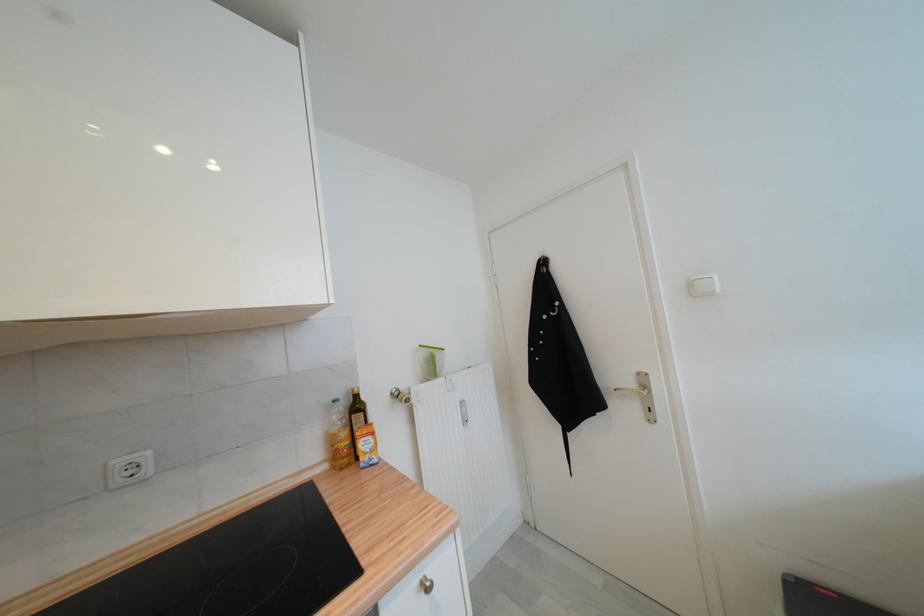
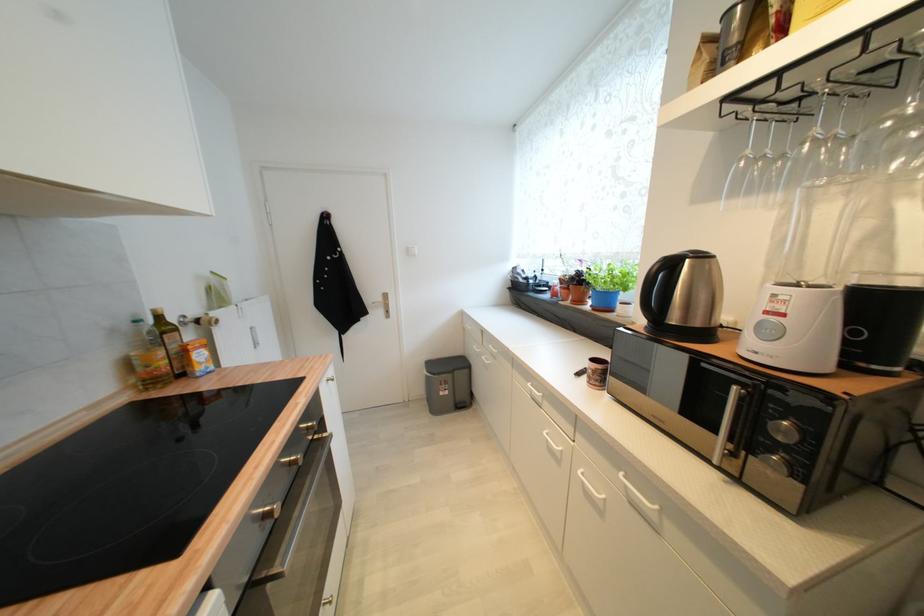
Question: The images are taken continuously from a first-person perspective. In which direction is your viewpoint rotating?

Choices:
 (A) Left
 (B) Right
 (C) Up
 (D) Down

Answer: (B)